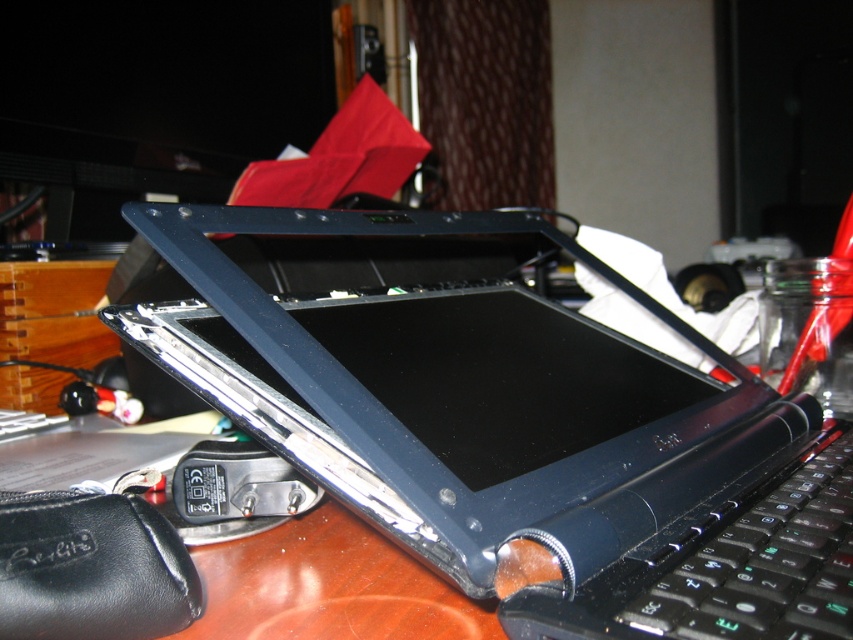
Question: Is satin black laptop at center to the left of black matte keyboard at lower right from the viewer's perspective?

Choices:
 (A) yes
 (B) no

Answer: (A)

Question: Does satin black laptop at center lie behind black matte keyboard at lower right?

Choices:
 (A) yes
 (B) no

Answer: (B)

Question: Which object is farther from the camera taking this photo?

Choices:
 (A) satin black laptop at center
 (B) black matte keyboard at lower right

Answer: (B)

Question: Is satin black laptop at center positioned behind black matte keyboard at lower right?

Choices:
 (A) no
 (B) yes

Answer: (A)